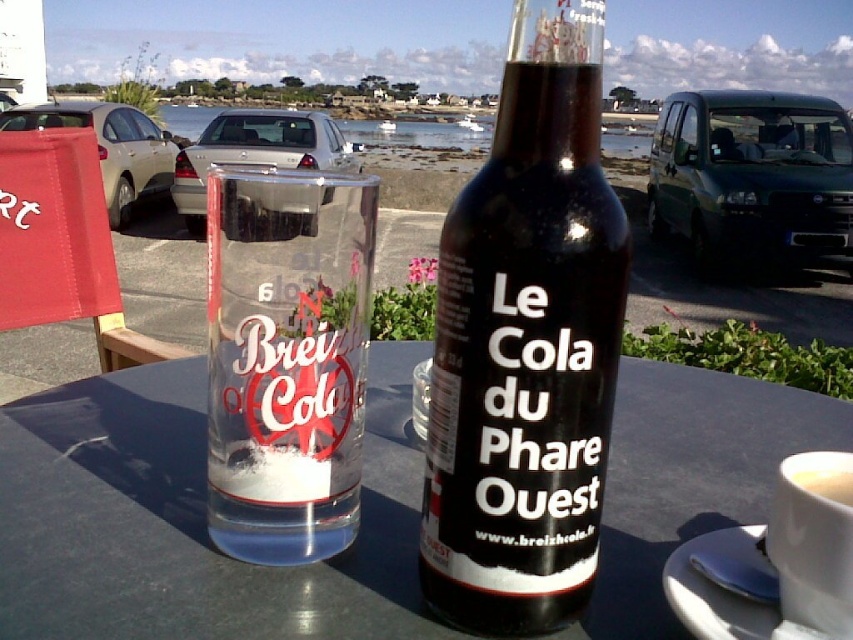
Question: Does white ceramic saucer at lower right appear on the left side of white matte cup at upper right?

Choices:
 (A) yes
 (B) no

Answer: (A)

Question: Which object is the closest to the clear glass cup at center?

Choices:
 (A) black glass bottle at center
 (B) transparent glass at center

Answer: (A)

Question: Is clear glass cup at center to the right of white ceramic saucer at lower right from the viewer's perspective?

Choices:
 (A) no
 (B) yes

Answer: (A)

Question: Which object is the closest to the white matte cup at upper right?

Choices:
 (A) white ceramic saucer at lower right
 (B) clear glass cup at center
 (C) black glass bottle at center

Answer: (A)

Question: Does black glass bottle at center appear on the right side of white ceramic saucer at lower right?

Choices:
 (A) no
 (B) yes

Answer: (A)

Question: Which of these objects is positioned farthest from the transparent glass at center?

Choices:
 (A) white ceramic saucer at lower right
 (B) white matte cup at upper right

Answer: (B)